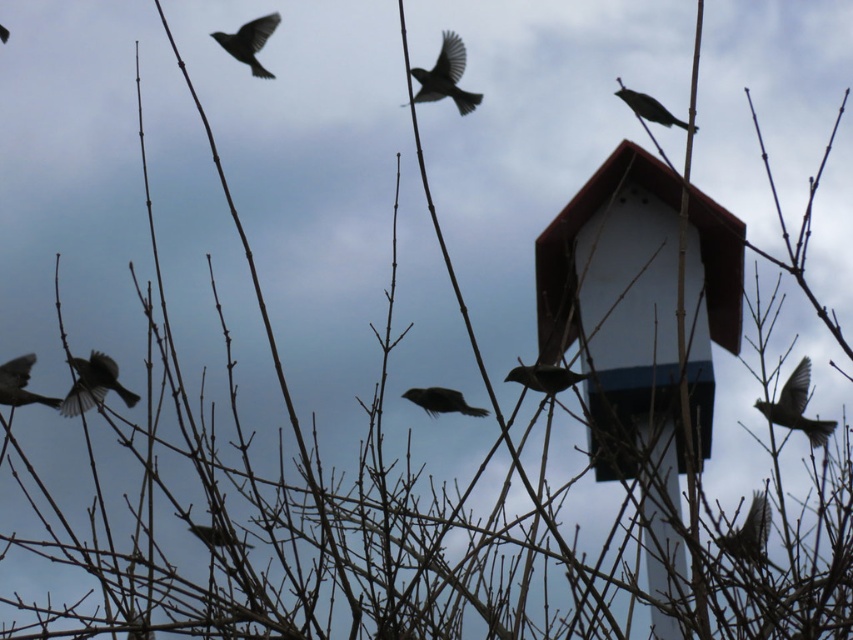
You are standing in a park and see a gray feathered bird at right. If you want to take a photo of it with your smartphone camera, which has a maximum focus range of 3 meters, will you be able to capture it clearly?

The gray feathered bird at right is 3.21 meters away from the camera. Since the smartphone camera has a maximum focus range of 3 meters, it cannot focus clearly beyond that distance. Therefore, the bird will be out of focus and not captured clearly.

You are an ornithologist observing the scene. You notice two birds in the image. Which one is positioned closer to you, the gray feathered bird at right or the silvery metallic bird at upper right?

The gray feathered bird at right is closer to the viewer than the silvery metallic bird at upper right.